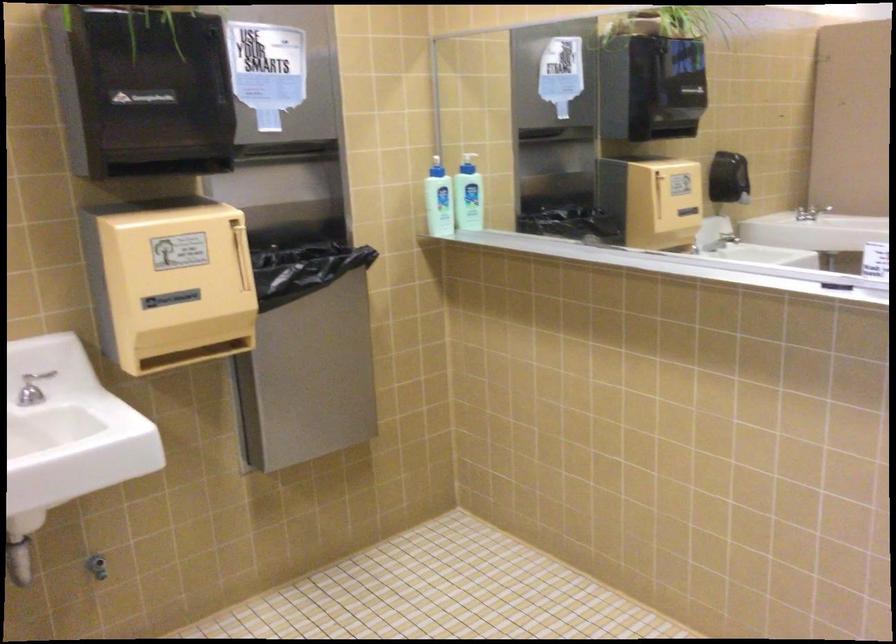
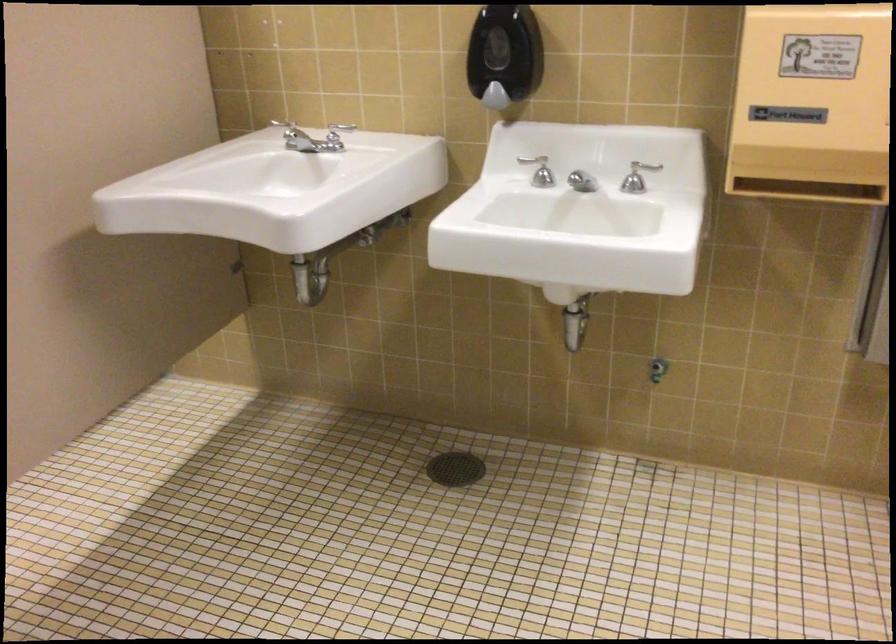
The images are taken continuously from a first-person perspective. In which direction is your viewpoint rotating?

The rotation direction of the camera is left-down.